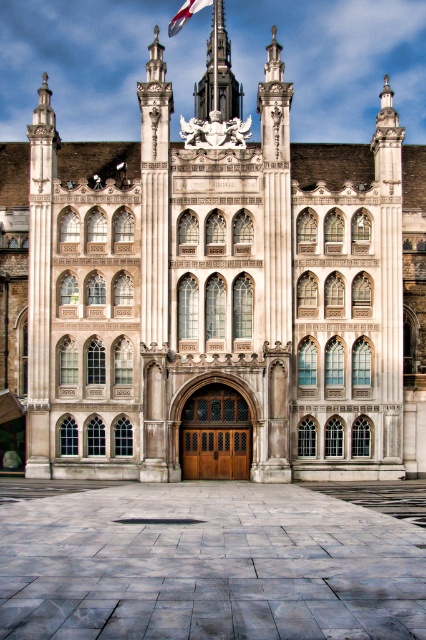
You are an architect analyzing the symmetry of the building. The polished stone pillar at upper left and the white fabric flag at upper center are both positioned on the upper part of the facade. Which object has a greater width?

The polished stone pillar at upper left has a greater width than the white fabric flag at upper center.

You are standing in front of the grand historic building. There is a point marked at coordinates (40, 282). Which object does this point correspond to?

The point corresponds to the polished stone pillar at upper left.